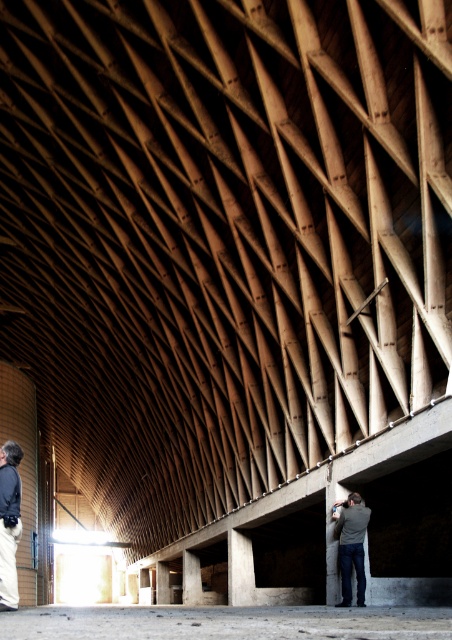
Question: Where is dark gray jacket at lower left located in relation to gray fabric jacket at lower center in the image?

Choices:
 (A) above
 (B) below

Answer: (A)

Question: Is dark gray jacket at lower left bigger than gray fabric jacket at lower center?

Choices:
 (A) no
 (B) yes

Answer: (A)

Question: Does dark gray jacket at lower left lie behind gray fabric jacket at lower center?

Choices:
 (A) yes
 (B) no

Answer: (B)

Question: Which of the following is the closest to the observer?

Choices:
 (A) dark gray jacket at lower left
 (B) gray fabric jacket at lower center

Answer: (A)

Question: Which point appears farthest from the camera in this image?

Choices:
 (A) (347, 580)
 (B) (0, 502)

Answer: (A)

Question: Which point appears farthest from the camera in this image?

Choices:
 (A) (357, 557)
 (B) (15, 468)

Answer: (A)